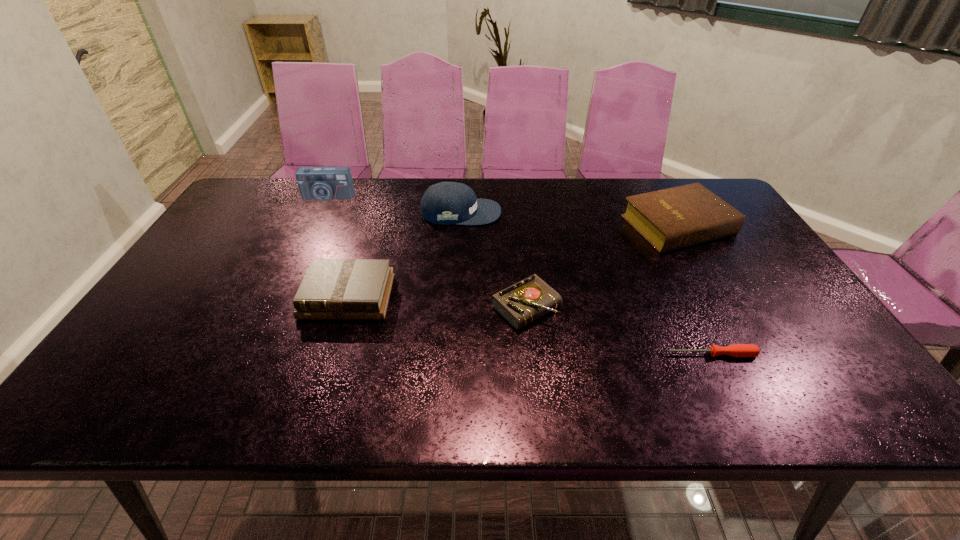
In the image, there is a desktop. Where is `free space at the far edge`? The image size is (960, 540). free space at the far edge is located at coordinates (562, 206).

Find the location of a particular element. vacant area at the near edge is located at coordinates (293, 403).

The image size is (960, 540). I want to click on free space at the left edge, so click(x=216, y=230).

At what (x,y) coordinates should I click in order to perform the action: click on vacant space at the right edge of the desktop. Please return your answer as a coordinate pair (x, y). Looking at the image, I should click on (768, 292).

The height and width of the screenshot is (540, 960). I want to click on free space at the far left corner of the desktop, so click(x=280, y=197).

In the image, there is a desktop. Identify the location of vacant space at the near left corner. (135, 414).

I want to click on vacant area between the nearest object and the camera, so click(519, 275).

Find the location of `blank region between the right Bible and the screwdriver`. blank region between the right Bible and the screwdriver is located at coordinates (695, 289).

At what (x,y) coordinates should I click in order to perform the action: click on empty space that is in between the right Bible and the shortest object. Please return your answer as a coordinate pair (x, y). The width and height of the screenshot is (960, 540). Looking at the image, I should click on pos(695,289).

The width and height of the screenshot is (960, 540). I want to click on free spot between the nearer Bible and the nearest object, so point(530,325).